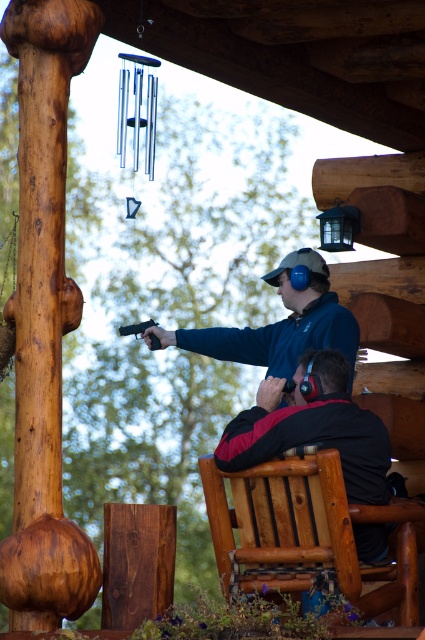
Question: Which point is farther from the camera taking this photo?

Choices:
 (A) (62, 280)
 (B) (387, 499)
 (C) (292, 333)
 (D) (127, 326)

Answer: (D)

Question: Is the position of polished wood post at left less distant than that of wooden chair at lower right?

Choices:
 (A) no
 (B) yes

Answer: (B)

Question: Considering the real-world distances, which object is farthest from the polished wood post at left?

Choices:
 (A) wooden chair at lower right
 (B) black plastic gun at center

Answer: (B)

Question: Which of the following is the farthest from the observer?

Choices:
 (A) polished wood post at left
 (B) black plastic gun at center
 (C) black matte jacket at center
 (D) blue matte jacket at center

Answer: (B)

Question: Can you confirm if black matte jacket at center is positioned to the left of black plastic gun at center?

Choices:
 (A) yes
 (B) no

Answer: (B)

Question: Is polished wood post at left to the left of black matte jacket at center from the viewer's perspective?

Choices:
 (A) yes
 (B) no

Answer: (A)